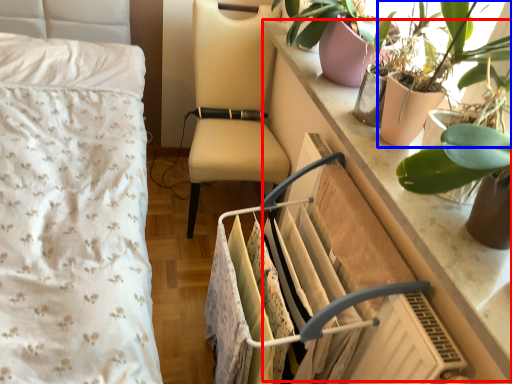
Question: Which object appears closest to the camera in this image, counter top (highlighted by a red box) or houseplant (highlighted by a blue box)?

Choices:
 (A) counter top
 (B) houseplant

Answer: (A)